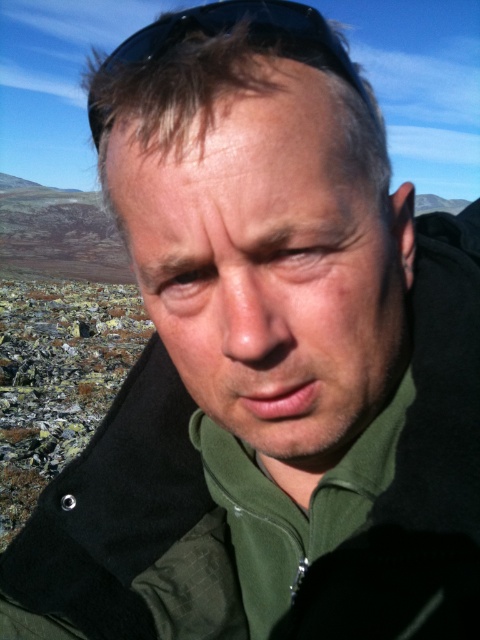
Can you confirm if matte green jacket at center is positioned below black matte sunglasses at upper center?

Yes, matte green jacket at center is below black matte sunglasses at upper center.

Measure the distance from matte green jacket at center to black matte sunglasses at upper center.

matte green jacket at center is 5.95 inches from black matte sunglasses at upper center.

You are a GUI agent. You are given a task and a screenshot of the screen. Output one action in this format:
    pyautogui.click(x=<x>, y=<y>)
    Task: Click on the matte green jacket at center
    The height and width of the screenshot is (640, 480).
    Given the screenshot: What is the action you would take?
    pyautogui.click(x=269, y=266)

Who is more distant from viewer, (227, 320) or (98, 68)?

Positioned behind is point (98, 68).

Does point (295, 316) come in front of point (155, 45)?

Yes.

Find the location of a particular element. smooth skin nose at center is located at coordinates (256, 308).

Between matte green jacket at center and smooth skin nose at center, which one has more height?

With more height is matte green jacket at center.

In the scene shown: Can you confirm if matte green jacket at center is thinner than smooth skin nose at center?

No, matte green jacket at center is not thinner than smooth skin nose at center.

Which is behind, point (264, 291) or point (256, 252)?

Point (264, 291)

This screenshot has height=640, width=480. I want to click on matte green jacket at center, so click(269, 266).